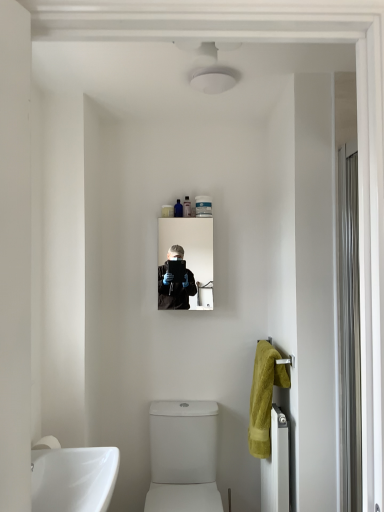
At what (x,y) coordinates should I click in order to perform the action: click on vacant space situated above clear glass mirror at center (from a real-world perspective). Please return your answer as a coordinate pair (x, y). This screenshot has width=384, height=512. Looking at the image, I should click on (192, 216).